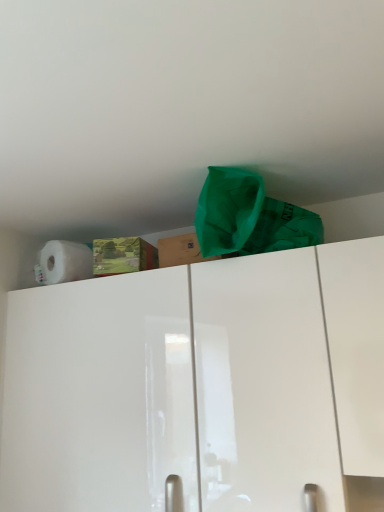
Question: Considering the positions of point (266, 488) and point (210, 249), is point (266, 488) closer or farther from the camera than point (210, 249)?

Choices:
 (A) closer
 (B) farther

Answer: (A)

Question: Is white glossy cabinet at upper center taller or shorter than green fabric bag at upper center?

Choices:
 (A) short
 (B) tall

Answer: (B)

Question: Which object is positioned closest to the brown cardboard box at upper center?

Choices:
 (A) white matte paper towel at upper left
 (B) white glossy cabinet at upper center
 (C) green fabric bag at upper center

Answer: (C)

Question: Which is nearer to the white glossy cabinet at upper center?

Choices:
 (A) white matte paper towel at upper left
 (B) brown cardboard box at upper center
 (C) green fabric bag at upper center

Answer: (C)